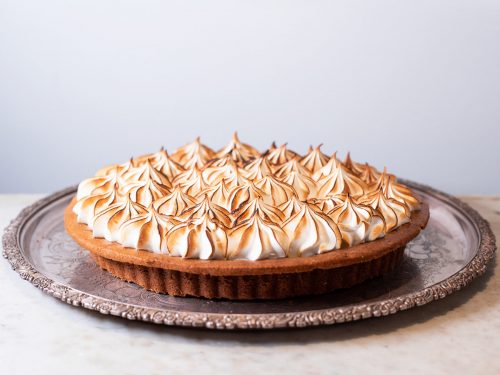
The height and width of the screenshot is (375, 500). Find the location of `wall`. wall is located at coordinates (75, 117).